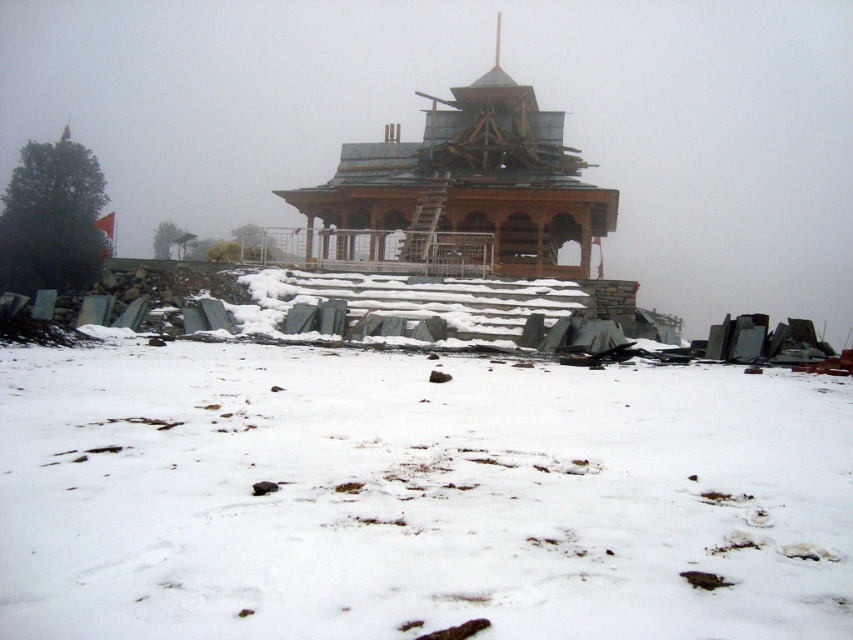
Question: Which object is closer to the camera taking this photo?

Choices:
 (A) wooden temple at center
 (B) white powdery snow at center

Answer: (B)

Question: In this image, where is white powdery snow at center located relative to wooden temple at center?

Choices:
 (A) right
 (B) left

Answer: (B)

Question: Can you confirm if white powdery snow at center is wider than wooden temple at center?

Choices:
 (A) yes
 (B) no

Answer: (B)

Question: Which point is farther to the camera?

Choices:
 (A) (724, 621)
 (B) (492, 99)

Answer: (B)

Question: Does white powdery snow at center have a lesser width compared to wooden temple at center?

Choices:
 (A) yes
 (B) no

Answer: (A)